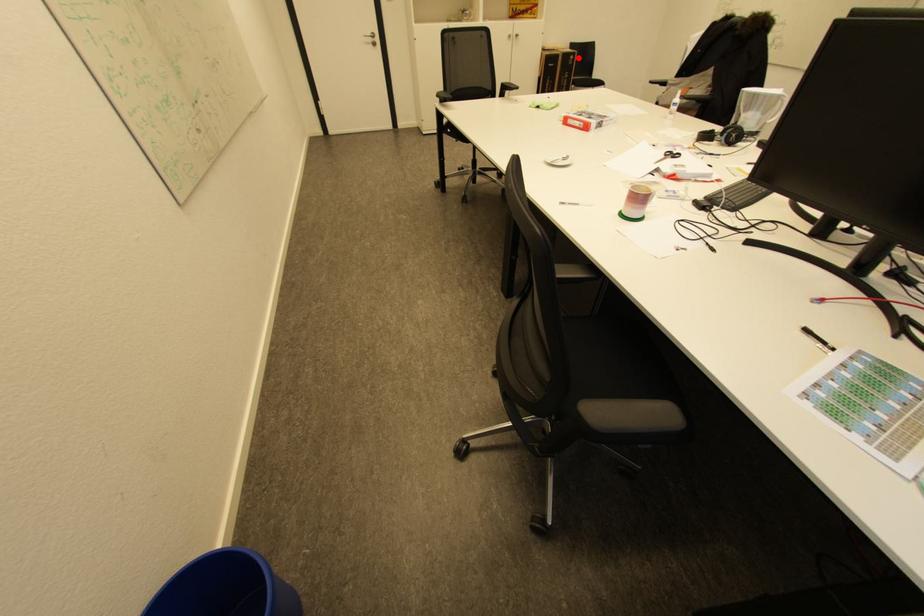
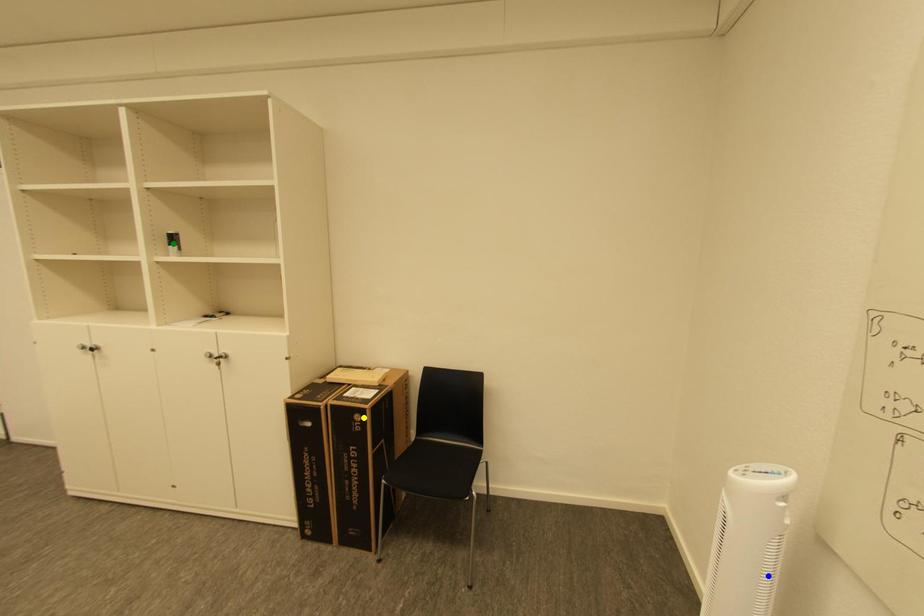
Question: I am providing you with two images of the same scene from different viewpoints. A red point is marked on the first image. You are given multiple points on the second image. Which mark in image 2 goes with the point in image 1?

Choices:
 (A) green point
 (B) blue point
 (C) yellow point

Answer: (C)